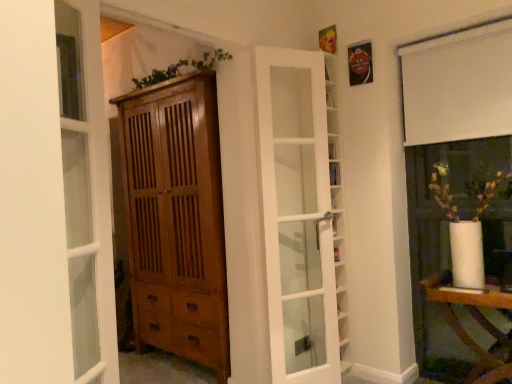
Question: From the image's perspective, would you say clear glass door at left is shown under white glass door at center?

Choices:
 (A) no
 (B) yes

Answer: (A)

Question: Can white glass door at center be found inside clear glass door at left?

Choices:
 (A) no
 (B) yes

Answer: (A)

Question: From a real-world perspective, is clear glass door at left below white glass door at center?

Choices:
 (A) no
 (B) yes

Answer: (A)

Question: From the image's perspective, does clear glass door at left appear higher than white glass door at center?

Choices:
 (A) no
 (B) yes

Answer: (B)

Question: Is clear glass door at left positioned in front of white glass door at center?

Choices:
 (A) yes
 (B) no

Answer: (A)

Question: Is clear glass door at left outside white glass door at center?

Choices:
 (A) no
 (B) yes

Answer: (B)

Question: From the image's perspective, is clear glass door at left beneath white glossy table at lower right?

Choices:
 (A) no
 (B) yes

Answer: (A)

Question: Is clear glass door at left positioned with its back to white glossy table at lower right?

Choices:
 (A) no
 (B) yes

Answer: (A)

Question: Considering the relative positions of clear glass door at left and white glossy table at lower right in the image provided, is clear glass door at left to the left of white glossy table at lower right from the viewer's perspective?

Choices:
 (A) no
 (B) yes

Answer: (B)

Question: Is white glossy table at lower right surrounded by clear glass door at left?

Choices:
 (A) no
 (B) yes

Answer: (A)

Question: Does clear glass door at left lie in front of white glossy table at lower right?

Choices:
 (A) no
 (B) yes

Answer: (B)

Question: Does clear glass door at left have a greater height compared to white glossy table at lower right?

Choices:
 (A) yes
 (B) no

Answer: (A)

Question: Is white glossy table at lower right not inside white glass door at center?

Choices:
 (A) yes
 (B) no

Answer: (A)